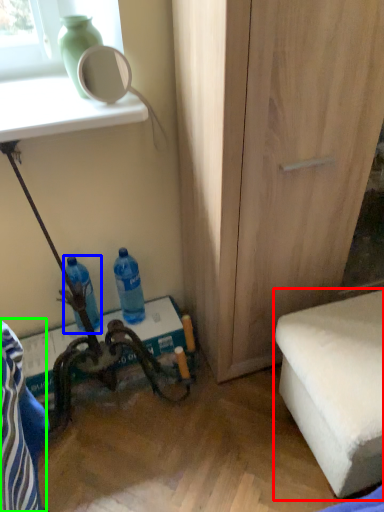
Question: Estimate the real-world distances between objects in this image. Which object is closer to furniture (highlighted by a red box), bottle (highlighted by a blue box) or swivel chair (highlighted by a green box)?

Choices:
 (A) bottle
 (B) swivel chair

Answer: (B)